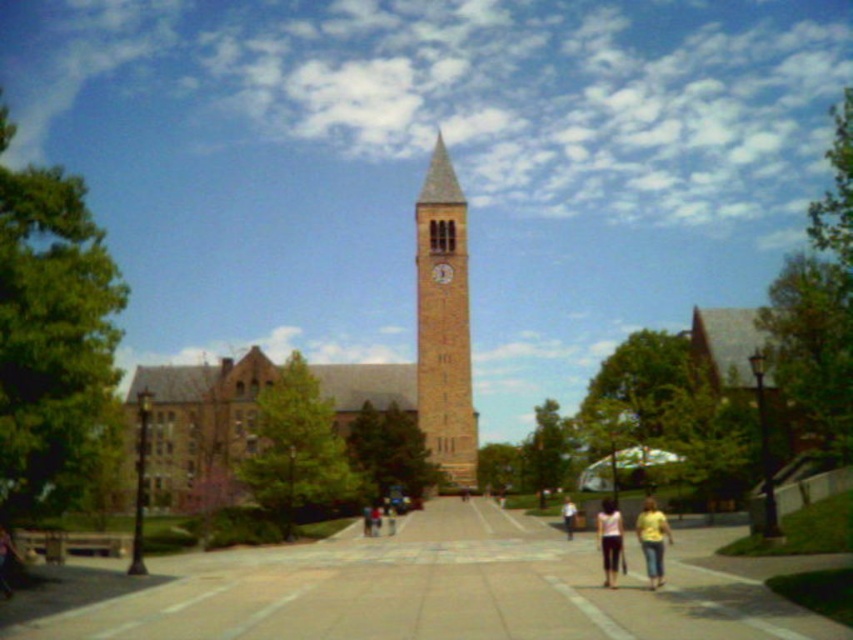
You are standing at the point marked as point [469,420] on the campus map. You want to walk straight towards the tall brick clock tower at the center. How far will you have to walk to reach the base of the clock tower?

The distance between point [469,420] and the viewer is 171.77 meters, so you will have to walk approximately 171.77 meters to reach the base of the clock tower.

You are standing at the point marked by the coordinates point (426,339) in the image. What is the nearest object to you?

The nearest object to you is the brown stone church at center, as the point (426,339) marks its location.

You are standing at the entrance of the campus and want to reach the point marked at coordinates point (602,540). If your walking speed is 1.5 meters per second, how many seconds will it take you to reach that point?

The distance of point (602,540) from camera is 113.80 meters. At a walking speed of 1.5 meters per second, it will take approximately 75.87 seconds to reach the point.